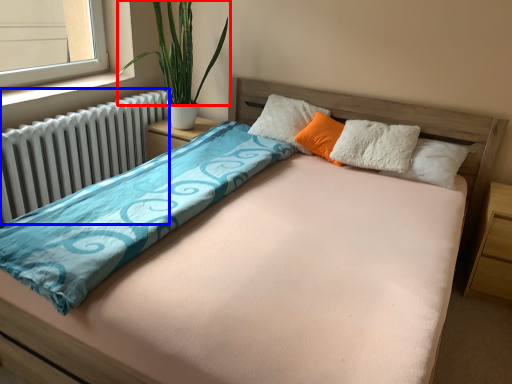
Question: Which point is further to the camera, plant (highlighted by a red box) or radiator (highlighted by a blue box)?

Choices:
 (A) plant
 (B) radiator

Answer: (A)